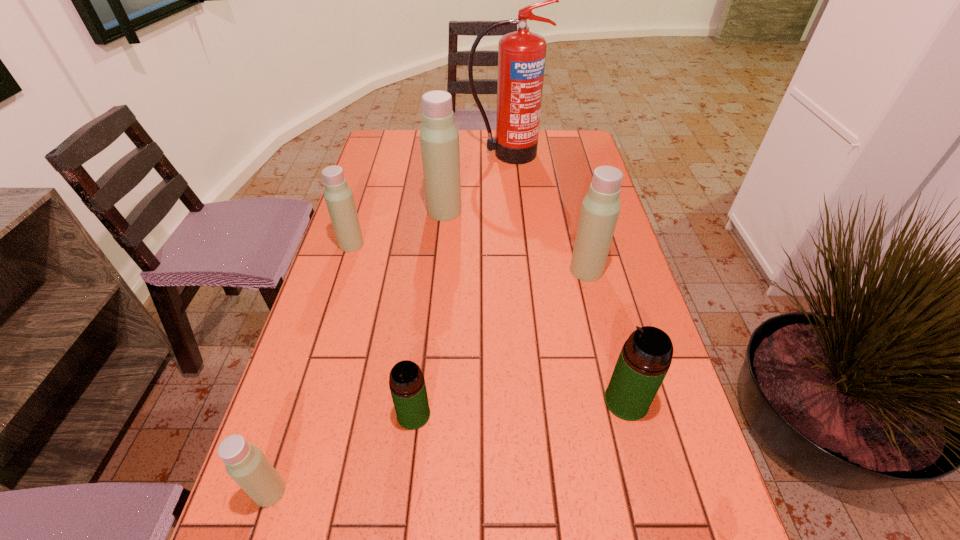
At what (x,y) coordinates should I click in order to perform the action: click on free region located 0.190m on the right of the smallest light thermos bottle. Please return your answer as a coordinate pair (x, y). Looking at the image, I should click on (393, 491).

Image resolution: width=960 pixels, height=540 pixels. What are the coordinates of `object located in the far edge section of the desktop` in the screenshot? It's located at (521, 54).

This screenshot has height=540, width=960. I want to click on vacant region at the left edge of the desktop, so click(x=301, y=500).

Locate an element on the screen. vacant space at the right edge of the desktop is located at coordinates [625, 272].

In the image, there is a desktop. Where is `free region at the far left corner`? The image size is (960, 540). free region at the far left corner is located at coordinates (406, 144).

At what (x,y) coordinates should I click in order to perform the action: click on empty location between the fifth shortest thermos bottle and the fifth nearest object. Please return your answer as a coordinate pair (x, y). Image resolution: width=960 pixels, height=540 pixels. Looking at the image, I should click on (468, 257).

This screenshot has width=960, height=540. Identify the location of free space between the right green thermos bottle and the biggest light thermos bottle. 536,306.

Locate an element on the screen. Image resolution: width=960 pixels, height=540 pixels. free space that is in between the left green thermos bottle and the third tallest object is located at coordinates (500, 342).

The height and width of the screenshot is (540, 960). In order to click on unoccupied area between the right green thermos bottle and the third biggest light thermos bottle in this screenshot , I will do `click(489, 322)`.

This screenshot has height=540, width=960. What are the coordinates of `free spot between the nearest light thermos bottle and the tallest object` in the screenshot? It's located at point(388,322).